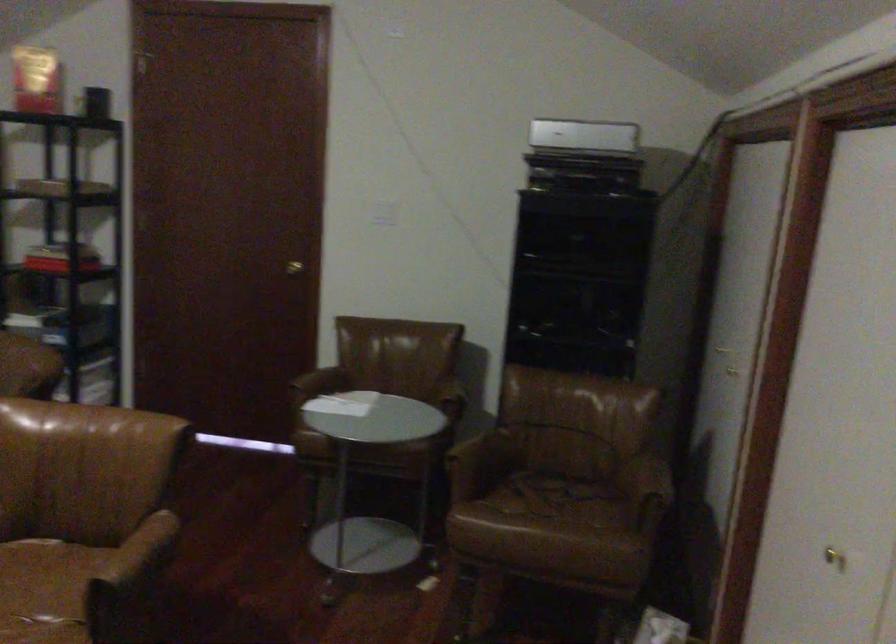
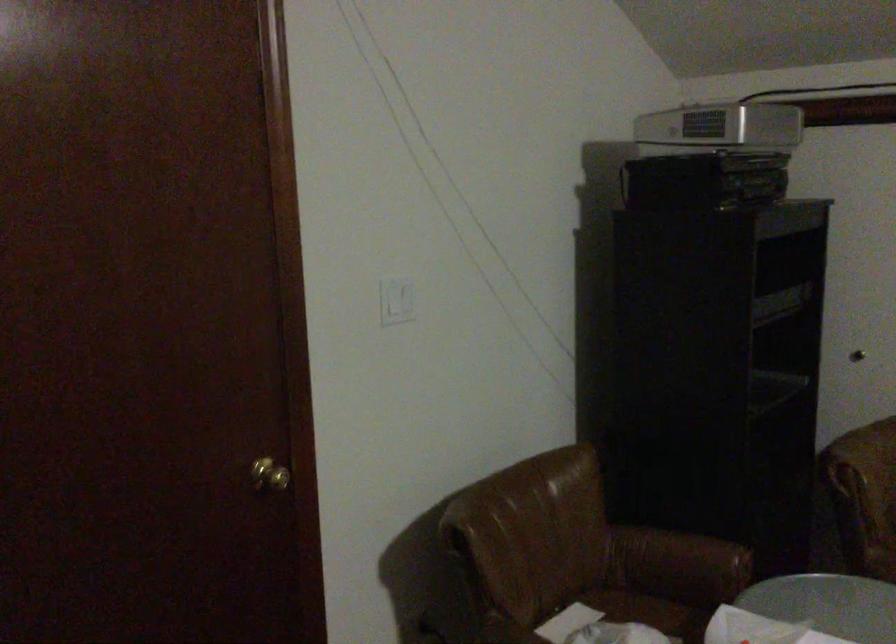
The point at (386, 204) is marked in the first image. Where is the corresponding point in the second image?

(397, 301)